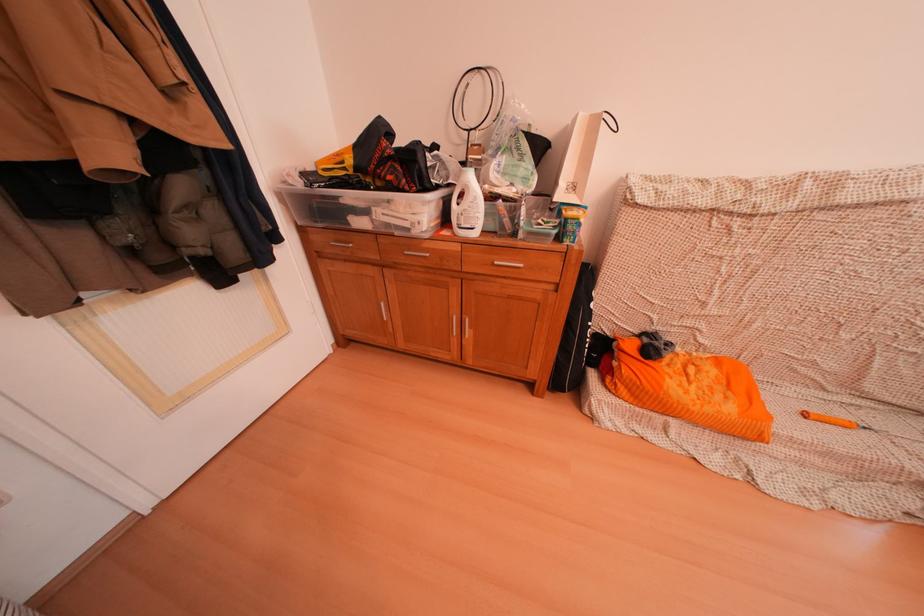
Where would you pull the cabinet door handle? Please return your answer as a coordinate pair (x, y).

(338, 248)